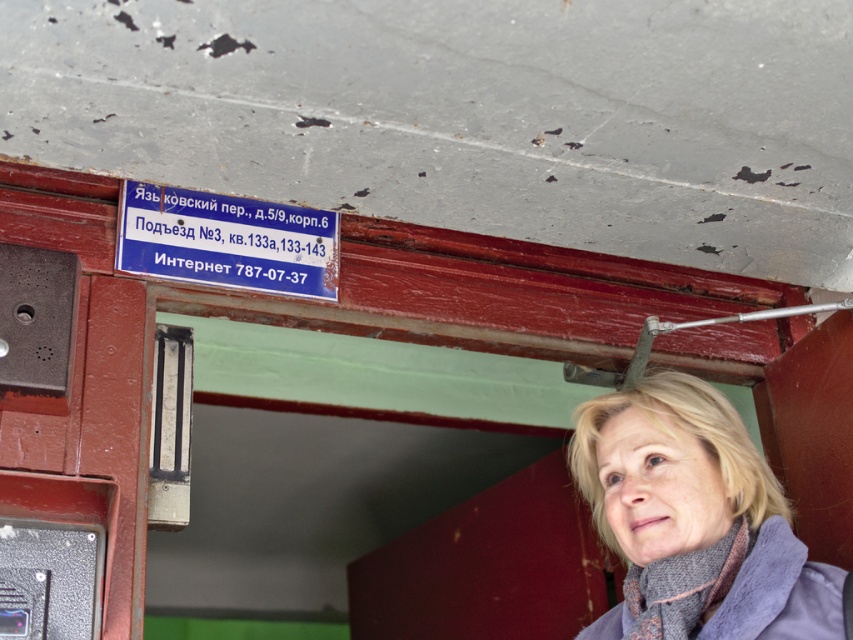
Question: Can you confirm if blue plastic sign at upper center is positioned to the left of black textured phone box at lower left?

Choices:
 (A) no
 (B) yes

Answer: (A)

Question: Is the position of blonde hair at upper right more distant than that of blue plastic sign at upper center?

Choices:
 (A) yes
 (B) no

Answer: (B)

Question: Estimate the real-world distances between objects in this image. Which object is closer to the blonde hair at upper right?

Choices:
 (A) black textured phone box at lower left
 (B) blue plastic sign at upper center

Answer: (A)

Question: Is blonde hair at upper right bigger than blue plastic sign at upper center?

Choices:
 (A) yes
 (B) no

Answer: (A)

Question: Which is nearer to the blue plastic sign at upper center?

Choices:
 (A) black textured phone box at lower left
 (B) blonde hair at upper right

Answer: (A)

Question: Among these objects, which one is nearest to the camera?

Choices:
 (A) blue plastic sign at upper center
 (B) black textured phone box at lower left

Answer: (B)